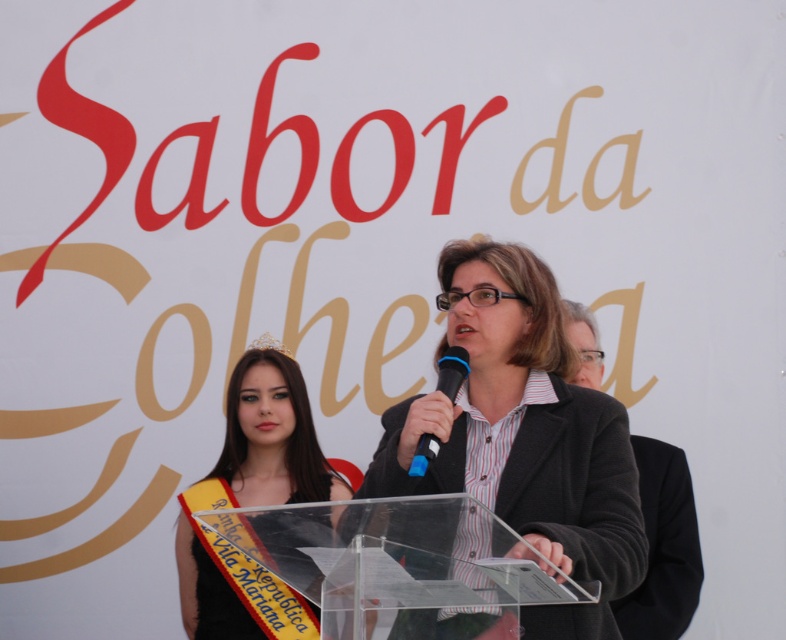
You are attending the event and want to take a photo of both the matte black jacket at center and the gold metallic tiara at upper center. Which object should you focus on first to ensure both are in clear view?

You should focus on the matte black jacket at center first since it is closer to the viewer than the gold metallic tiara at upper center, ensuring both are in clear focus when adjusting the camera accordingly.

You are attending the Sabor da Colheita event and notice two items of clothing. The yellow satin sash at left and the black wool coat at center. Which item is shorter in height?

The yellow satin sash at left has a lesser height compared to the black wool coat at center, so the yellow satin sash at left is shorter in height.